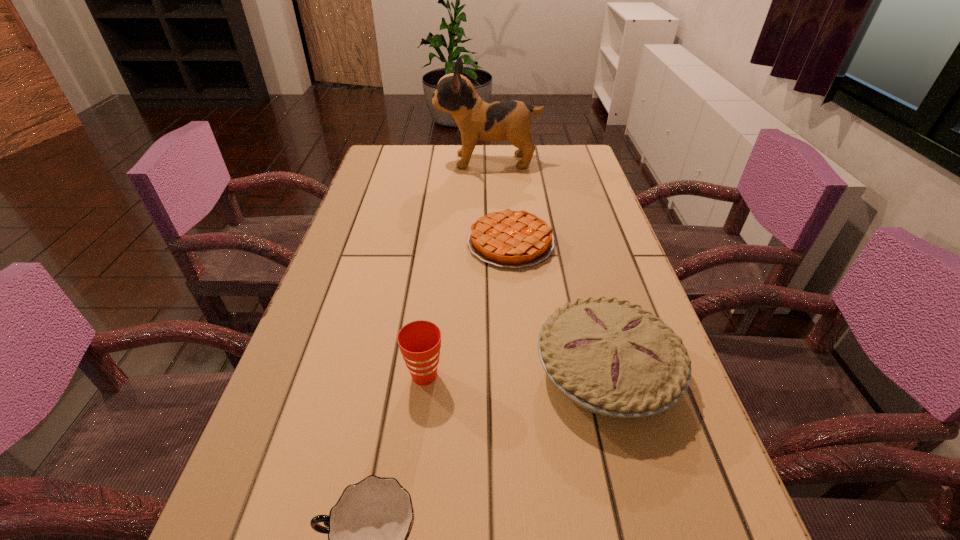
The height and width of the screenshot is (540, 960). Find the location of `vacant region located on the back of the taller pie`. vacant region located on the back of the taller pie is located at coordinates (570, 234).

I want to click on vacant space located 0.400m on the back of the second farthest object, so click(503, 154).

Where is `object present at the far edge`? The height and width of the screenshot is (540, 960). object present at the far edge is located at coordinates (477, 119).

Where is `object located in the right edge section of the desktop`? object located in the right edge section of the desktop is located at coordinates (611, 357).

I want to click on vacant space at the left edge, so click(298, 450).

This screenshot has height=540, width=960. In the image, there is a desktop. What are the coordinates of `free space at the right edge` in the screenshot? It's located at (581, 232).

Image resolution: width=960 pixels, height=540 pixels. Identify the location of blank space at the far left corner of the desktop. (394, 161).

At what (x,y) coordinates should I click in order to perform the action: click on vacant space at the far right corner. Please return your answer as a coordinate pair (x, y). This screenshot has width=960, height=540. Looking at the image, I should click on (581, 155).

Locate an element on the screen. blank region between the nearer pie and the farthest object is located at coordinates (547, 266).

At what (x,y) coordinates should I click in order to perform the action: click on free space that is in between the taller pie and the farthest object. Please return your answer as a coordinate pair (x, y). Looking at the image, I should click on (547, 266).